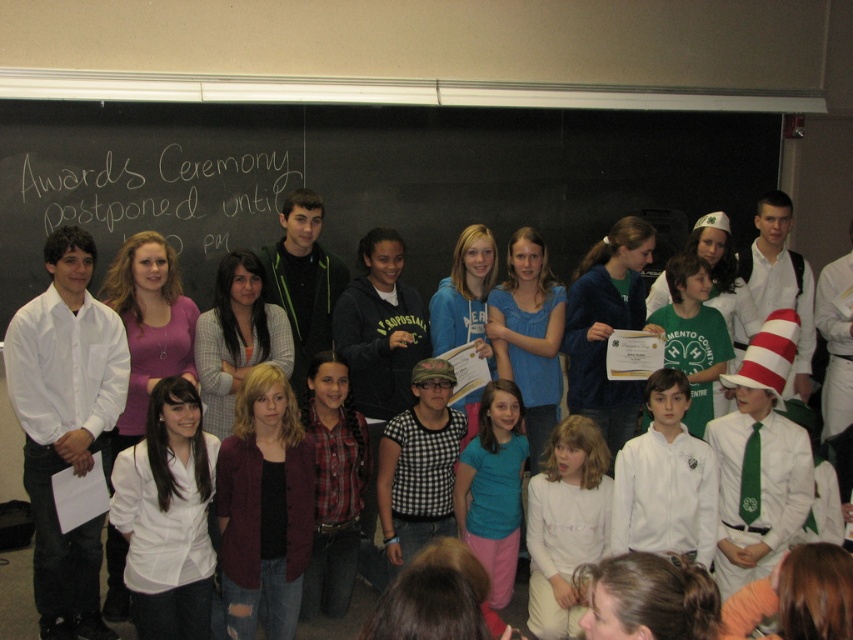
Can you confirm if white shirt at center is shorter than teal matte shirt at center?

Yes, white shirt at center is shorter than teal matte shirt at center.

Between white shirt at center and teal matte shirt at center, which one appears on the right side from the viewer's perspective?

Positioned to the right is white shirt at center.

Measure the distance between white shirt at center and camera.

3.20 meters

Identify the location of white shirt at center. (665, 481).

Does black chalkboard at upper center come in front of white shirt at center?

No, black chalkboard at upper center is further to the viewer.

Which is more to the right, black chalkboard at upper center or white shirt at center?

white shirt at center is more to the right.

Is point (253, 241) behind point (709, 468)?

Yes, it is behind point (709, 468).

Find the location of a particular element. Image resolution: width=853 pixels, height=640 pixels. black chalkboard at upper center is located at coordinates (360, 179).

Is green cotton shirt at center behind white shirt at right?

No, it is not.

Between point (683, 275) and point (833, 396), which one is positioned behind?

The point (833, 396) is more distant.

Find the location of a particular element. green cotton shirt at center is located at coordinates (693, 336).